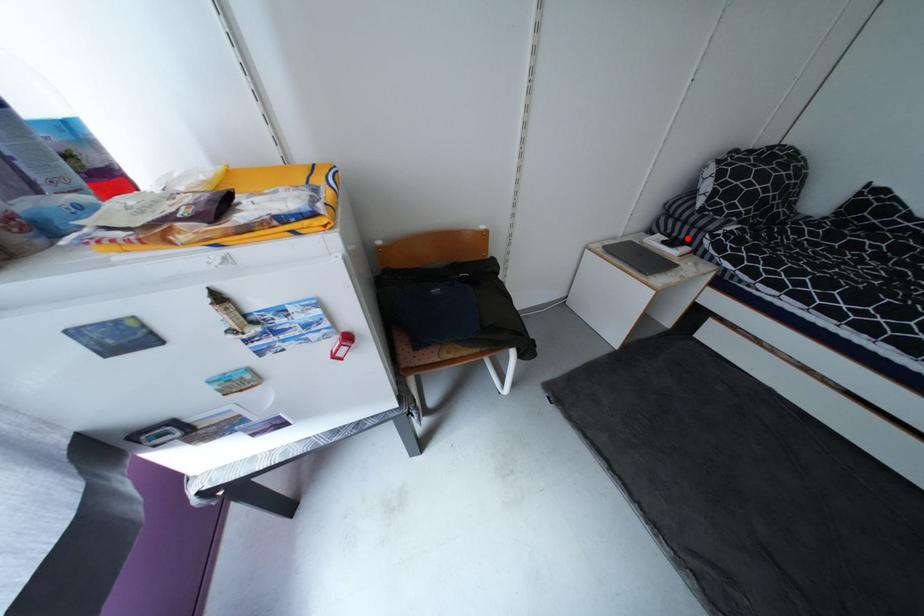
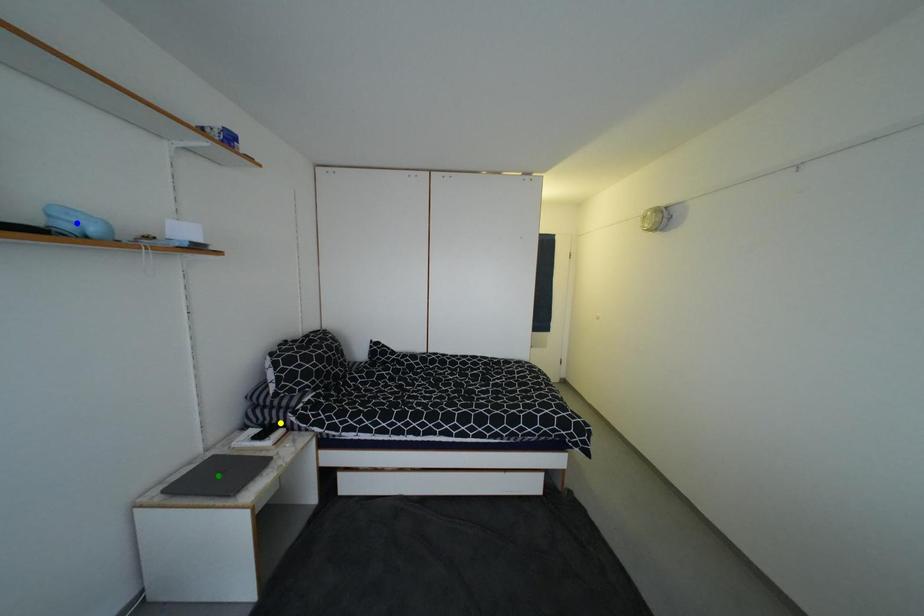
Question: I am providing you with two images of the same scene from different viewpoints. A red point is marked on the first image. You are given multiple points on the second image. Which mark in image 2 goes with the point in image 1?

Choices:
 (A) green point
 (B) yellow point
 (C) blue point

Answer: (B)